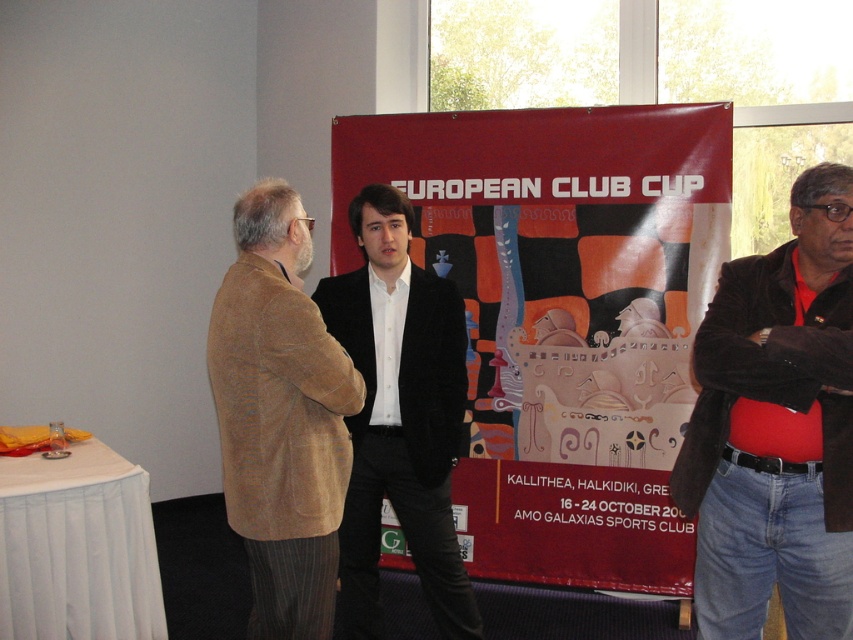
You are standing in front of the large red banner at the European Club Cup event. There are two points marked on the banner at coordinates point (299, 500) and point (432, 545). Which of these points is nearer to your viewpoint?

Point (299, 500) is closer to the camera than point (432, 545).

You are a fashion designer observing the scene. You need to determine which of the two jackets, the velvet brown jacket at right or the brown corduroy blazer at center, has a shorter length. Which one is it?

The velvet brown jacket at right is shorter than the brown corduroy blazer at center.